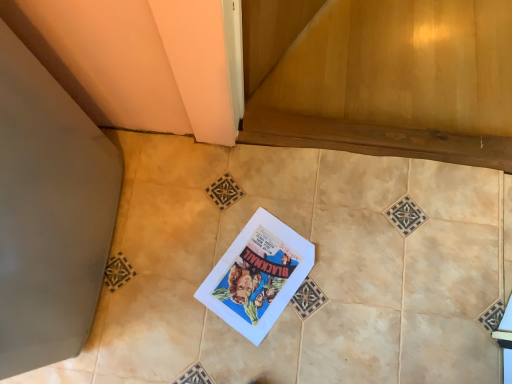
The height and width of the screenshot is (384, 512). Describe the element at coordinates (382, 77) in the screenshot. I see `wooden at lower center` at that location.

Find the location of a particular element. The image size is (512, 384). beige ceramic tile at center is located at coordinates (311, 271).

This screenshot has height=384, width=512. What are the coordinates of `wooden at lower center` in the screenshot? It's located at (382, 77).

Can you confirm if matte paper comic book at center is bigger than wooden at lower center?

Actually, matte paper comic book at center might be smaller than wooden at lower center.

Locate an element on the screen. comic book in front of the wooden at lower center is located at coordinates (257, 276).

Can you confirm if matte paper comic book at center is taller than wooden at lower center?

No.

Looking at their sizes, would you say matte paper comic book at center is wider or thinner than wooden at lower center?

In the image, matte paper comic book at center appears to be more narrow than wooden at lower center.

How many degrees apart are the facing directions of beige ceramic tile at center and wooden at lower center?

180 degrees.

Does beige ceramic tile at center have a greater width compared to wooden at lower center?

Indeed, beige ceramic tile at center has a greater width compared to wooden at lower center.

Considering the positions of objects beige ceramic tile at center and wooden at lower center in the image provided, who is in front, beige ceramic tile at center or wooden at lower center?

beige ceramic tile at center.

From the image's perspective, is beige ceramic tile at center on wooden at lower center?

A: No, from the image's perspective, beige ceramic tile at center is not over wooden at lower center.

From the image's perspective, which one is positioned higher, beige ceramic tile at center or matte paper comic book at center?

beige ceramic tile at center is shown above in the image.

Considering the positions of objects beige ceramic tile at center and matte paper comic book at center in the image provided, who is more to the left, beige ceramic tile at center or matte paper comic book at center?

matte paper comic book at center.

Is beige ceramic tile at center turned away from matte paper comic book at center?

Yes.

From a real-world perspective, which object stands above the other?

beige ceramic tile at center.

Consider the image. Is wooden at lower center smaller than matte paper comic book at center?

No.

Measure the distance from wooden at lower center to matte paper comic book at center.

The distance of wooden at lower center from matte paper comic book at center is 19.55 inches.

Consider the image. Is wooden at lower center touching matte paper comic book at center?

No, wooden at lower center is not with matte paper comic book at center.

Could you tell me if wooden at lower center is turned towards matte paper comic book at center?

Yes.

In the scene shown: Would you consider wooden at lower center to be distant from beige ceramic tile at center?

No, wooden at lower center is in close proximity to beige ceramic tile at center.

Which object is positioned more to the right, wooden at lower center or beige ceramic tile at center?

wooden at lower center.

From the image's perspective, which is below, wooden at lower center or beige ceramic tile at center?

beige ceramic tile at center is shown below in the image.

Considering the sizes of wooden at lower center and beige ceramic tile at center in the image, is wooden at lower center bigger or smaller than beige ceramic tile at center?

Considering their sizes, wooden at lower center takes up less space than beige ceramic tile at center.

From the image's perspective, between matte paper comic book at center and beige ceramic tile at center, who is located below?

matte paper comic book at center, from the image's perspective.

Which of these two, matte paper comic book at center or beige ceramic tile at center, is bigger?

With larger size is beige ceramic tile at center.

In the scene shown: Which is more to the right, matte paper comic book at center or beige ceramic tile at center?

beige ceramic tile at center is more to the right.

Choose the correct answer: Is matte paper comic book at center inside beige ceramic tile at center or outside it?

matte paper comic book at center exists entirely within beige ceramic tile at center.

Where is `comic book on the left of wooden at lower center`? comic book on the left of wooden at lower center is located at coordinates (257, 276).

What are the coordinates of `stairwell located above the beige ceramic tile at center (from a real-world perspective)` in the screenshot? It's located at (382, 77).

From the image, which object appears to be nearer to wooden at lower center, beige ceramic tile at center or matte paper comic book at center?

beige ceramic tile at center.

Considering their positions, is beige ceramic tile at center positioned closer to matte paper comic book at center than wooden at lower center?

beige ceramic tile at center.

Looking at the image, which one is located closer to wooden at lower center, matte paper comic book at center or beige ceramic tile at center?

beige ceramic tile at center is positioned closer to the anchor wooden at lower center.

When comparing their distances from beige ceramic tile at center, does wooden at lower center or matte paper comic book at center seem closer?

Based on the image, matte paper comic book at center appears to be nearer to beige ceramic tile at center.

Considering their positions, is wooden at lower center positioned closer to matte paper comic book at center than beige ceramic tile at center?

beige ceramic tile at center.

From the picture: Considering their positions, is matte paper comic book at center positioned further to beige ceramic tile at center than wooden at lower center?

wooden at lower center lies further to beige ceramic tile at center than the other object.

The height and width of the screenshot is (384, 512). What are the coordinates of `ceramic tile between wooden at lower center and matte paper comic book at center in the vertical direction` in the screenshot? It's located at (311, 271).